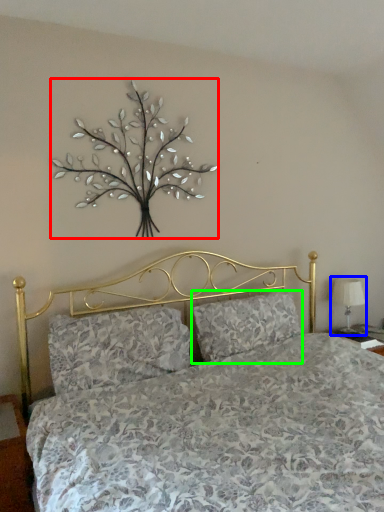
Question: Estimate the real-world distances between objects in this image. Which object is closer to floral arrangement (highlighted by a red box), table lamp (highlighted by a blue box) or pillow (highlighted by a green box)?

Choices:
 (A) table lamp
 (B) pillow

Answer: (B)